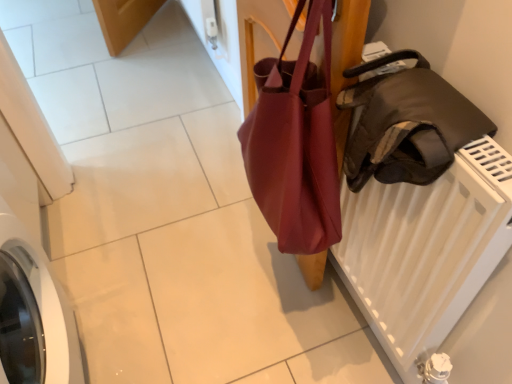
You are a GUI agent. You are given a task and a screenshot of the screen. Output one action in this format:
    pyautogui.click(x=<x>, y=<y>)
    Task: Click on the vacant position to the left of matte brown bag at center
    
    Given the screenshot: What is the action you would take?
    172,218